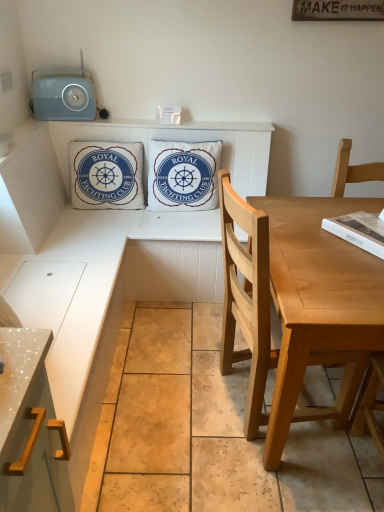
Question: Is white cotton cushion at center, the second pillow when ordered from left to right, directly adjacent to metallic gold cabinet handle at lower left?

Choices:
 (A) yes
 (B) no

Answer: (B)

Question: Is there a large distance between white cotton cushion at center, positioned as the 1th pillow in right-to-left order, and metallic gold cabinet handle at lower left?

Choices:
 (A) yes
 (B) no

Answer: (A)

Question: Can you confirm if white cotton cushion at center, the second pillow when ordered from left to right, is shorter than metallic gold cabinet handle at lower left?

Choices:
 (A) yes
 (B) no

Answer: (A)

Question: Can you confirm if white cotton cushion at center, positioned as the 1th pillow in right-to-left order, is positioned to the right of metallic gold cabinet handle at lower left?

Choices:
 (A) yes
 (B) no

Answer: (A)

Question: Is white cotton cushion at center, positioned as the 1th pillow in right-to-left order, outside of metallic gold cabinet handle at lower left?

Choices:
 (A) yes
 (B) no

Answer: (A)

Question: Considering their positions, is white cotton cushion at center, positioned as the 1th pillow in right-to-left order, located in front of or behind metallic gold cabinet handle at lower left?

Choices:
 (A) behind
 (B) front

Answer: (A)

Question: In the image, is white cotton cushion at center, the second pillow when ordered from left to right, on the left side or the right side of metallic gold cabinet handle at lower left?

Choices:
 (A) right
 (B) left

Answer: (A)

Question: From their relative heights in the image, would you say white cotton cushion at center, positioned as the 1th pillow in right-to-left order, is taller or shorter than metallic gold cabinet handle at lower left?

Choices:
 (A) tall
 (B) short

Answer: (B)

Question: Looking at their shapes, would you say white cotton cushion at center, positioned as the 1th pillow in right-to-left order, is wider or thinner than metallic gold cabinet handle at lower left?

Choices:
 (A) thin
 (B) wide

Answer: (A)

Question: In terms of size, does white cotton cushion at center, the second pillow when ordered from left to right, appear bigger or smaller than white cotton cushion at upper center, which is counted as the 2th pillow, starting from the right?

Choices:
 (A) big
 (B) small

Answer: (A)

Question: Is white cotton cushion at center, positioned as the 1th pillow in right-to-left order, situated inside white cotton cushion at upper center, which is counted as the 2th pillow, starting from the right, or outside?

Choices:
 (A) outside
 (B) inside

Answer: (A)

Question: From a real-world perspective, is white cotton cushion at center, the second pillow when ordered from left to right, above or below white cotton cushion at upper center, which is counted as the 2th pillow, starting from the right?

Choices:
 (A) below
 (B) above

Answer: (B)

Question: Is point (208, 165) positioned closer to the camera than point (109, 147)?

Choices:
 (A) farther
 (B) closer

Answer: (A)

Question: From their relative heights in the image, would you say light wood chair at right is taller or shorter than white cotton cushion at upper center, the first pillow viewed from the left?

Choices:
 (A) tall
 (B) short

Answer: (A)

Question: Visually, is light wood chair at right positioned to the left or to the right of white cotton cushion at upper center, the first pillow viewed from the left?

Choices:
 (A) right
 (B) left

Answer: (A)